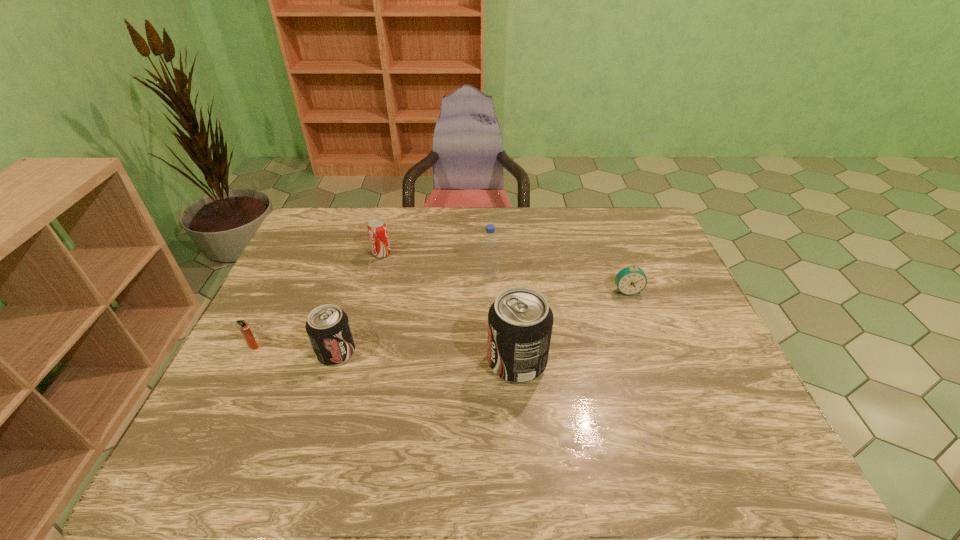
Image resolution: width=960 pixels, height=540 pixels. Identify the location of vacant area situated 0.140m on the front of the leftmost object. (228, 397).

The width and height of the screenshot is (960, 540). Find the location of `object that is at the left edge`. object that is at the left edge is located at coordinates (243, 326).

Where is `object that is positioned at the right edge`? This screenshot has width=960, height=540. object that is positioned at the right edge is located at coordinates (631, 280).

Locate an element on the screen. The image size is (960, 540). vacant space at the far edge of the desktop is located at coordinates (520, 241).

The width and height of the screenshot is (960, 540). What are the coordinates of `vacant space at the left edge of the desktop` in the screenshot? It's located at (238, 370).

This screenshot has width=960, height=540. I want to click on free space at the right edge, so click(698, 349).

This screenshot has width=960, height=540. In order to click on free space at the far left corner of the desktop in this screenshot , I will do `click(347, 224)`.

In the image, there is a desktop. At what (x,y) coordinates should I click in order to perform the action: click on vacant space at the near right corner. Please return your answer as a coordinate pair (x, y). Looking at the image, I should click on (743, 399).

Identify the location of free area in between the rightmost soda can and the igniter. (385, 354).

The height and width of the screenshot is (540, 960). Find the location of `blank region between the tallest soda can and the third farthest object`. blank region between the tallest soda can and the third farthest object is located at coordinates (572, 326).